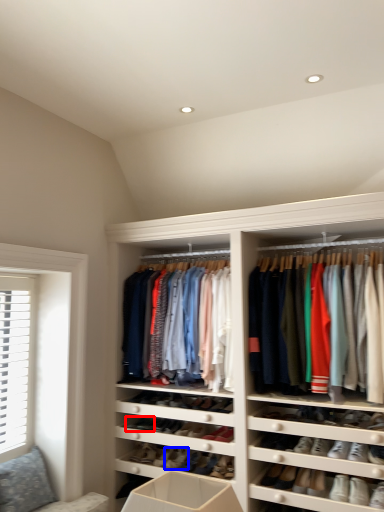
Question: Which object is further to the camera taking this photo, shoe (highlighted by a red box) or shoe (highlighted by a blue box)?

Choices:
 (A) shoe
 (B) shoe

Answer: (A)